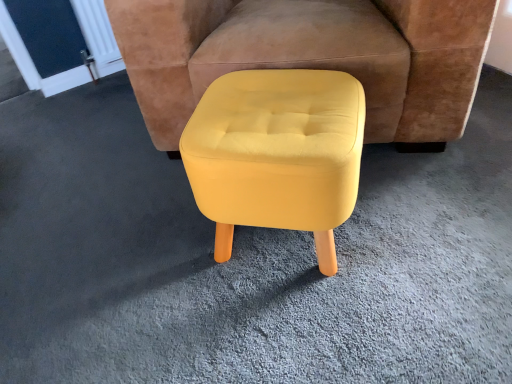
Describe the element at coordinates (336, 68) in the screenshot. I see `yellow fabric ottoman at center` at that location.

Locate an element on the screen. This screenshot has height=384, width=512. yellow fabric ottoman at center is located at coordinates (336, 68).

What do you see at coordinates (277, 154) in the screenshot? Image resolution: width=512 pixels, height=384 pixels. I see `yellow fabric stool at center` at bounding box center [277, 154].

Find the location of a particular element. This screenshot has width=512, height=384. yellow fabric stool at center is located at coordinates (277, 154).

Identify the location of yellow fabric ottoman at center. Image resolution: width=512 pixels, height=384 pixels. (336, 68).

Visually, is yellow fabric stool at center positioned to the left or to the right of yellow fabric ottoman at center?

yellow fabric stool at center is positioned on yellow fabric ottoman at center's left side.

Which object is more forward, yellow fabric stool at center or yellow fabric ottoman at center?

yellow fabric stool at center is closer to the camera.

Which is in front, point (326, 153) or point (329, 3)?

The point (326, 153) is closer to the camera.

From the image's perspective, is yellow fabric stool at center located above or below yellow fabric ottoman at center?

From the image's perspective, yellow fabric stool at center appears below yellow fabric ottoman at center.

From a real-world perspective, is yellow fabric stool at center under yellow fabric ottoman at center?

Yes, from a real-world perspective, yellow fabric stool at center is below yellow fabric ottoman at center.

Is yellow fabric stool at center thinner than yellow fabric ottoman at center?

Correct, the width of yellow fabric stool at center is less than that of yellow fabric ottoman at center.

Is yellow fabric stool at center taller than yellow fabric ottoman at center?

No, yellow fabric stool at center is not taller than yellow fabric ottoman at center.

Who is smaller, yellow fabric stool at center or yellow fabric ottoman at center?

Result: With smaller size is yellow fabric stool at center.

Is yellow fabric stool at center inside or outside of yellow fabric ottoman at center?

yellow fabric stool at center is outside yellow fabric ottoman at center.

Would you consider yellow fabric stool at center to be distant from yellow fabric ottoman at center?

Actually, yellow fabric stool at center and yellow fabric ottoman at center are a little close together.

From the picture: Could you tell me if yellow fabric stool at center is facing yellow fabric ottoman at center?

No, yellow fabric stool at center is not aimed at yellow fabric ottoman at center.

In the image, there is a yellow fabric stool at center. Where is `chair above it (from the image's perspective)`? Image resolution: width=512 pixels, height=384 pixels. chair above it (from the image's perspective) is located at coordinates (336, 68).

Considering the positions of objects yellow fabric ottoman at center and yellow fabric stool at center in the image provided, who is more to the left, yellow fabric ottoman at center or yellow fabric stool at center?

yellow fabric stool at center.

Which object is closer to the camera taking this photo, yellow fabric ottoman at center or yellow fabric stool at center?

yellow fabric stool at center is more forward.

Which point is more forward, (420, 26) or (298, 154)?

Point (298, 154)

From the image's perspective, which is below, yellow fabric ottoman at center or yellow fabric stool at center?

From the image's view, yellow fabric stool at center is below.

From a real-world perspective, which is physically above, yellow fabric ottoman at center or yellow fabric stool at center?

From a 3D spatial view, yellow fabric ottoman at center is above.

Between yellow fabric ottoman at center and yellow fabric stool at center, which one has larger width?

yellow fabric ottoman at center.

Between yellow fabric ottoman at center and yellow fabric stool at center, which one has more height?

yellow fabric ottoman at center.

Looking at this image, considering the relative sizes of yellow fabric ottoman at center and yellow fabric stool at center in the image provided, is yellow fabric ottoman at center bigger than yellow fabric stool at center?

Yes.

Is yellow fabric ottoman at center completely or partially outside of yellow fabric stool at center?

Yes, yellow fabric ottoman at center is outside of yellow fabric stool at center.

Is yellow fabric ottoman at center with yellow fabric stool at center?

They are not placed beside each other.

Is yellow fabric stool at center at the back of yellow fabric ottoman at center?

No, yellow fabric ottoman at center is not facing the opposite direction of yellow fabric stool at center.

How different are the orientations of yellow fabric ottoman at center and yellow fabric stool at center in degrees?

The angle between the facing direction of yellow fabric ottoman at center and the facing direction of yellow fabric stool at center is 6.74 degrees.

How far apart are yellow fabric ottoman at center and yellow fabric stool at center?

yellow fabric ottoman at center and yellow fabric stool at center are 11.85 inches apart.

You are a GUI agent. You are given a task and a screenshot of the screen. Output one action in this format:
    pyautogui.click(x=<x>, y=<y>)
    Task: Click on the stool below the yellow fabric ottoman at center (from a real-world perspective)
    This screenshot has height=384, width=512.
    Given the screenshot: What is the action you would take?
    pyautogui.click(x=277, y=154)

Locate an element on the screen. stool that appears on the left of yellow fabric ottoman at center is located at coordinates (277, 154).

You are a GUI agent. You are given a task and a screenshot of the screen. Output one action in this format:
    pyautogui.click(x=<x>, y=<y>)
    Task: Click on the stool below the yellow fabric ottoman at center (from a real-world perspective)
    This screenshot has height=384, width=512.
    Given the screenshot: What is the action you would take?
    pyautogui.click(x=277, y=154)